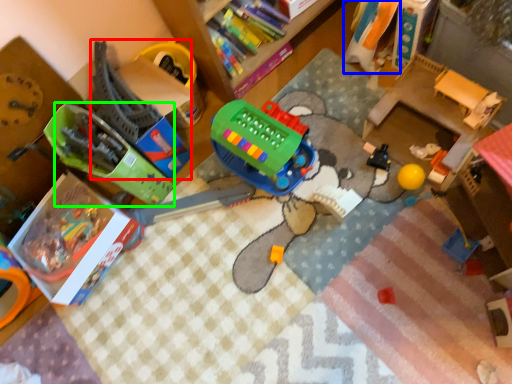
Question: Which object is the closest to the toy (highlighted by a red box)? Choose among these: toy (highlighted by a blue box) or toy (highlighted by a green box).

Choices:
 (A) toy
 (B) toy

Answer: (B)